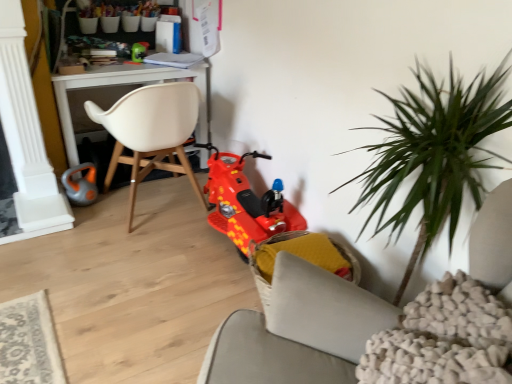
Question: Would you say shiny plastic scooter at center, which appears as the 3th toy when viewed from the left, is to the left or to the right of white plastic desk at upper left in the picture?

Choices:
 (A) right
 (B) left

Answer: (A)

Question: Is point (215, 153) positioned closer to the camera than point (68, 155)?

Choices:
 (A) closer
 (B) farther

Answer: (A)

Question: Which is farther from the yellow fabric chair at lower center, the second chair when ordered from top to bottom?

Choices:
 (A) white plastic desk at upper left
 (B) green plastic toy at upper center, the 2th toy in the right-to-left sequence
 (C) shiny plastic scooter at center, the first toy from the bottom
 (D) white matte chair at center, which is the 2th chair from right to left
 (E) orange rubber toy at lower left, arranged as the first toy when viewed from the left

Answer: (B)

Question: Which object is positioned closest to the white plastic desk at upper left?

Choices:
 (A) orange rubber toy at lower left, placed as the 2th toy when sorted from top to bottom
 (B) white matte chair at center, the 1th chair when ordered from top to bottom
 (C) green plastic toy at upper center, the third toy when ordered from bottom to top
 (D) shiny plastic scooter at center, placed as the first toy when sorted from right to left
 (E) yellow fabric chair at lower center, the second chair when ordered from top to bottom

Answer: (B)